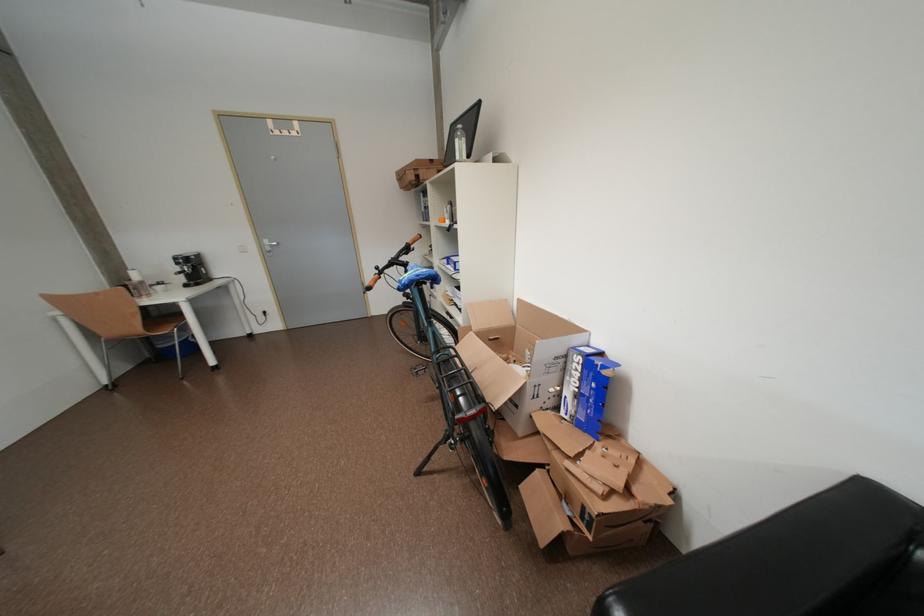
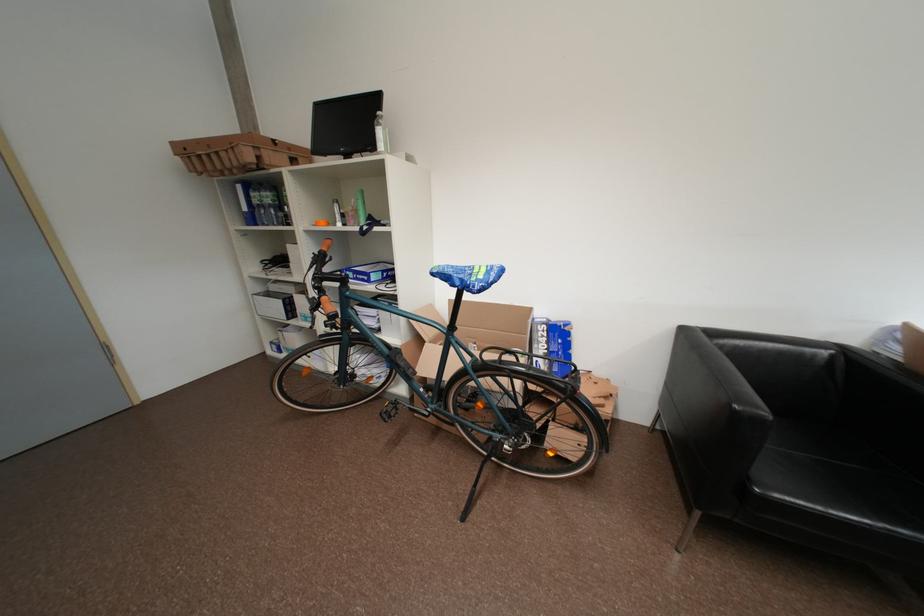
Question: How did the camera likely rotate?

Choices:
 (A) Left
 (B) Right
 (C) Up
 (D) Down

Answer: (B)